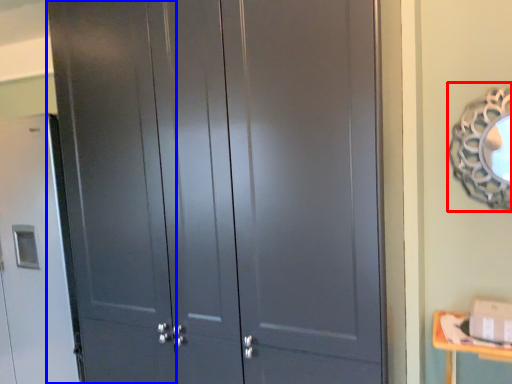
Question: Which point is closer to the camera, mirror (highlighted by a red box) or screen door (highlighted by a blue box)?

Choices:
 (A) mirror
 (B) screen door

Answer: (A)